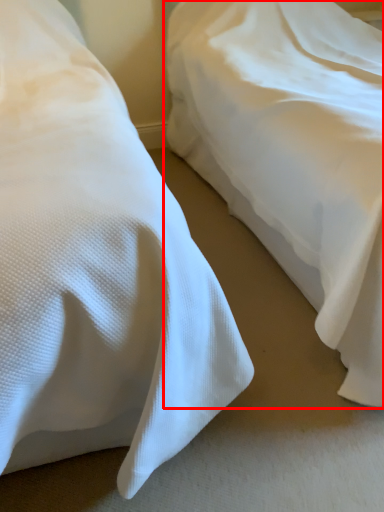
Question: Considering the relative positions of bed (annotated by the red box) and bed in the image provided, where is bed (annotated by the red box) located with respect to the staircase?

Choices:
 (A) right
 (B) left

Answer: (A)